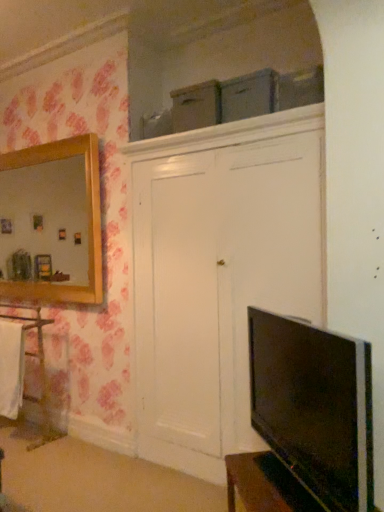
What is the approximate width of black glossy tv at lower right?

black glossy tv at lower right is 5.74 inches wide.

What is the approximate width of shiny black vanity at lower right?

16.05 inches.

What is the approximate height of shiny black vanity at lower right?

It is 11.72 inches.

This screenshot has height=512, width=384. What are the coordinates of `white wood cabinet at left` in the screenshot? It's located at (40, 372).

From the picture: Does white fabric towel at left have a greater width compared to black glossy tv at lower right?

No, white fabric towel at left is not wider than black glossy tv at lower right.

Considering the sizes of white fabric towel at left and black glossy tv at lower right in the image, is white fabric towel at left bigger or smaller than black glossy tv at lower right?

Clearly, white fabric towel at left is smaller in size than black glossy tv at lower right.

The height and width of the screenshot is (512, 384). Find the location of `television located on the right of white fabric towel at left`. television located on the right of white fabric towel at left is located at coordinates (314, 407).

How different are the orientations of white wood cabinet at left and shiny black vanity at lower right in degrees?

47.8 degrees.

From the picture: Which object is further away from the camera taking this photo, white wood cabinet at left or shiny black vanity at lower right?

white wood cabinet at left is behind.

Is white wood cabinet at left not close to shiny black vanity at lower right?

Yes, white wood cabinet at left is far from shiny black vanity at lower right.

Consider the image. From the image's perspective, which one is positioned higher, white wood cabinet at left or shiny black vanity at lower right?

white wood cabinet at left is shown above in the image.

Between shiny black vanity at lower right and white fabric towel at left, which one appears on the left side from the viewer's perspective?

white fabric towel at left.

In the image, is shiny black vanity at lower right positioned in front of or behind white fabric towel at left?

Clearly, shiny black vanity at lower right is in front of white fabric towel at left.

From the picture: Is shiny black vanity at lower right far away from white fabric towel at left?

Yes, shiny black vanity at lower right and white fabric towel at left are located far from each other.

Based on the photo, from the image's perspective, would you say shiny black vanity at lower right is positioned over white fabric towel at left?

Incorrect, from the image's perspective, shiny black vanity at lower right is lower than white fabric towel at left.

Between point (4, 384) and point (289, 476), which one is positioned behind?

The point (4, 384) is farther.

From the image's perspective, is white fabric towel at left above shiny black vanity at lower right?

Yes, from the image's perspective, white fabric towel at left is above shiny black vanity at lower right.

How many degrees apart are the facing directions of white fabric towel at left and shiny black vanity at lower right?

47.8 degrees.

Considering their positions, is black glossy tv at lower right located in front of or behind white fabric towel at left?

Clearly, black glossy tv at lower right is in front of white fabric towel at left.

Based on the photo, can you confirm if black glossy tv at lower right is shorter than white fabric towel at left?

Indeed, black glossy tv at lower right has a lesser height compared to white fabric towel at left.

From the image's perspective, which is below, black glossy tv at lower right or white fabric towel at left?

white fabric towel at left is shown below in the image.

Considering the relative positions of black glossy tv at lower right and white fabric towel at left in the image provided, is black glossy tv at lower right to the left or to the right of white fabric towel at left?

In the image, black glossy tv at lower right appears on the right side of white fabric towel at left.

From the image's perspective, which one is positioned higher, black glossy tv at lower right or white wood cabinet at left?

black glossy tv at lower right appears higher in the image.

The width and height of the screenshot is (384, 512). I want to click on television that appears above the white wood cabinet at left (from a real-world perspective), so click(x=314, y=407).

From a real-world perspective, which object rests below the other?

From a 3D spatial view, white wood cabinet at left is below.

Can you confirm if black glossy tv at lower right is bigger than white wood cabinet at left?

Actually, black glossy tv at lower right might be smaller than white wood cabinet at left.

Does black glossy tv at lower right have a greater height compared to shiny black vanity at lower right?

Yes, black glossy tv at lower right is taller than shiny black vanity at lower right.

From the picture: Between black glossy tv at lower right and shiny black vanity at lower right, which one is positioned behind?

shiny black vanity at lower right is more distant.

Which of these two, black glossy tv at lower right or shiny black vanity at lower right, is wider?

shiny black vanity at lower right.

Is black glossy tv at lower right smaller than shiny black vanity at lower right?

No, black glossy tv at lower right is not smaller than shiny black vanity at lower right.

This screenshot has height=512, width=384. In the image, there is a black glossy tv at lower right. What are the coordinates of `laundry below it (from the image's perspective)` in the screenshot? It's located at (11, 368).

Locate an element on the screen. The width and height of the screenshot is (384, 512). cabinetry on the left of shiny black vanity at lower right is located at coordinates (40, 372).

Looking at the image, which one is located further to black glossy tv at lower right, white wood cabinet at left or white fabric towel at left?

The object further to black glossy tv at lower right is white wood cabinet at left.

Estimate the real-world distances between objects in this image. Which object is closer to white wood cabinet at left, white fabric towel at left or shiny black vanity at lower right?

white fabric towel at left is positioned closer to the anchor white wood cabinet at left.

Considering their positions, is black glossy tv at lower right positioned closer to white wood cabinet at left than shiny black vanity at lower right?

shiny black vanity at lower right.

Estimate the real-world distances between objects in this image. Which object is closer to white fabric towel at left, black glossy tv at lower right or shiny black vanity at lower right?

shiny black vanity at lower right.

When comparing their distances from shiny black vanity at lower right, does white fabric towel at left or black glossy tv at lower right seem closer?

The object closer to shiny black vanity at lower right is black glossy tv at lower right.

Which object lies nearer to the anchor point white wood cabinet at left, white fabric towel at left or black glossy tv at lower right?

Among the two, white fabric towel at left is located nearer to white wood cabinet at left.

Which object lies nearer to the anchor point white fabric towel at left, white wood cabinet at left or black glossy tv at lower right?

white wood cabinet at left lies closer to white fabric towel at left than the other object.

From the image, which object appears to be nearer to black glossy tv at lower right, white wood cabinet at left or shiny black vanity at lower right?

shiny black vanity at lower right lies closer to black glossy tv at lower right than the other object.

What are the coordinates of `television between white wood cabinet at left and shiny black vanity at lower right in the horizontal direction` in the screenshot? It's located at (314, 407).

This screenshot has height=512, width=384. In order to click on television situated between white fabric towel at left and shiny black vanity at lower right from left to right in this screenshot , I will do `click(314, 407)`.

Where is `laundry located between white wood cabinet at left and shiny black vanity at lower right in the left-right direction`? laundry located between white wood cabinet at left and shiny black vanity at lower right in the left-right direction is located at coordinates (11, 368).

I want to click on laundry positioned between black glossy tv at lower right and white wood cabinet at left from near to far, so click(x=11, y=368).